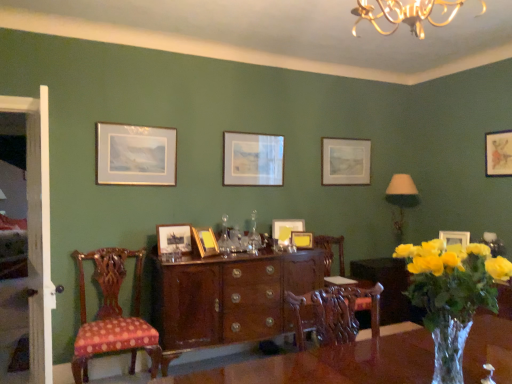
In order to face yellow matte picture frame at center, the fourth picture frame when ordered from right to left, should I rotate leftwards or rightwards?

A 6.381 degree turn to the right will do.

Describe the element at coordinates (302, 239) in the screenshot. Image resolution: width=512 pixels, height=384 pixels. I see `yellow matte picture frame at center, the fourth picture frame when ordered from right to left` at that location.

Image resolution: width=512 pixels, height=384 pixels. I want to click on white wooden door at left, so click(x=38, y=230).

Describe the element at coordinates (452, 295) in the screenshot. I see `translucent glass vase at lower right` at that location.

In order to face matte wooden picture frame at center, which is the 2th picture frame from left to right, should I rotate leftwards or rightwards?

You should look left and rotate roughly 10.808 degrees.

How much space does matte wooden picture frame at center, which is the 2th picture frame from left to right, occupy horizontally?

2.73 inches.

Find the location of a particular element. mahogany wood chair at center, acting as the second chair starting from the front is located at coordinates (331, 252).

What is the approximate width of polka dot fabric chair at left, placed as the 2th chair when sorted from right to left?

It is 22.03 inches.

You are a GUI agent. You are given a task and a screenshot of the screen. Output one action in this format:
    pyautogui.click(x=<x>, y=<y>)
    Task: Click on the yellow matte picture frame at center, the fourth picture frame when ordered from right to left
    
    Given the screenshot: What is the action you would take?
    pyautogui.click(x=302, y=239)

Can you tell me how much matte gold picture frame at upper right, which is the second picture frame in right-to-left order, and yellow matte picture frame at center, positioned as the sixth picture frame in left-to-right order, differ in facing direction?

19.4 degrees.

In the scene shown: Considering the relative sizes of matte gold picture frame at upper right, the 8th picture frame from the left, and yellow matte picture frame at center, the fourth picture frame when ordered from right to left, in the image provided, is matte gold picture frame at upper right, the 8th picture frame from the left, thinner than yellow matte picture frame at center, the fourth picture frame when ordered from right to left,?

Correct, the width of matte gold picture frame at upper right, the 8th picture frame from the left, is less than that of yellow matte picture frame at center, the fourth picture frame when ordered from right to left.

Could yellow matte picture frame at center, the fourth picture frame when ordered from right to left, be considered to be inside matte gold picture frame at upper right, the 8th picture frame from the left?

No, yellow matte picture frame at center, the fourth picture frame when ordered from right to left, is not a part of matte gold picture frame at upper right, the 8th picture frame from the left.

Is matte gold picture frame at upper right, which is the second picture frame in right-to-left order, oriented towards yellow matte picture frame at center, positioned as the sixth picture frame in left-to-right order?

No, matte gold picture frame at upper right, which is the second picture frame in right-to-left order, is not oriented towards yellow matte picture frame at center, positioned as the sixth picture frame in left-to-right order.

Is matte gold picture frame at upper right, which is the second picture frame in right-to-left order, positioned beyond the bounds of matte wooden picture frame at center, marked as the eighth picture frame in a right-to-left arrangement?

Yes, matte gold picture frame at upper right, which is the second picture frame in right-to-left order, is outside of matte wooden picture frame at center, marked as the eighth picture frame in a right-to-left arrangement.

Which of these two, matte gold picture frame at upper right, the 8th picture frame from the left, or matte wooden picture frame at center, which is the 2th picture frame from left to right, stands shorter?

matte gold picture frame at upper right, the 8th picture frame from the left, is shorter.

From a real-world perspective, is matte gold picture frame at upper right, which is the second picture frame in right-to-left order, below matte wooden picture frame at center, marked as the eighth picture frame in a right-to-left arrangement?

Yes.

Consider the image. Which is more to the right, matte gold picture frame at upper right, which is the second picture frame in right-to-left order, or matte wooden picture frame at center, marked as the eighth picture frame in a right-to-left arrangement?

matte gold picture frame at upper right, which is the second picture frame in right-to-left order, is more to the right.

From a real-world perspective, does white fabric lampshade at upper right stand above matte gold picture frame at center, which appears as the 4th picture frame when viewed from the left?

No, from a real-world perspective, white fabric lampshade at upper right is not on top of matte gold picture frame at center, which appears as the 4th picture frame when viewed from the left.

Is white fabric lampshade at upper right located outside matte gold picture frame at center, acting as the 6th picture frame starting from the right?

That's correct, white fabric lampshade at upper right is outside of matte gold picture frame at center, acting as the 6th picture frame starting from the right.

Is white fabric lampshade at upper right facing towards matte gold picture frame at center, acting as the 6th picture frame starting from the right?

No, white fabric lampshade at upper right is not turned towards matte gold picture frame at center, acting as the 6th picture frame starting from the right.

Considering the sizes of white fabric lampshade at upper right and matte gold picture frame at center, acting as the 6th picture frame starting from the right, in the image, is white fabric lampshade at upper right taller or shorter than matte gold picture frame at center, acting as the 6th picture frame starting from the right,?

In the image, white fabric lampshade at upper right appears to be taller than matte gold picture frame at center, acting as the 6th picture frame starting from the right.

From the image's perspective, is yellow matte picture frame at center, the fifth picture frame viewed from the right, located beneath gold-framed print at upper left, which ranks as the 1th picture frame in left-to-right order?

Yes, from the image's perspective, yellow matte picture frame at center, the fifth picture frame viewed from the right, is below gold-framed print at upper left, which ranks as the 1th picture frame in left-to-right order.

From the image's perspective, starting from the yellow matte picture frame at center, the fifth picture frame viewed from the right, which picture frame is the 1st one above? Please provide its 2D coordinates.

[(135, 155)]

Considering the relative sizes of yellow matte picture frame at center, the fifth picture frame viewed from the right, and gold-framed print at upper left, which ranks as the 9th picture frame in right-to-left order, in the image provided, is yellow matte picture frame at center, the fifth picture frame viewed from the right, bigger than gold-framed print at upper left, which ranks as the 9th picture frame in right-to-left order,?

Incorrect, yellow matte picture frame at center, the fifth picture frame viewed from the right, is not larger than gold-framed print at upper left, which ranks as the 9th picture frame in right-to-left order.

Is gold-framed print at upper left, which ranks as the 1th picture frame in left-to-right order, a part of yellow matte picture frame at center, acting as the 5th picture frame starting from the left?

No, gold-framed print at upper left, which ranks as the 1th picture frame in left-to-right order, is located outside of yellow matte picture frame at center, acting as the 5th picture frame starting from the left.

In terms of width, does matte gold picture frame at center, which appears as the 4th picture frame when viewed from the left, look wider or thinner when compared to yellow matte picture frame at center, the fourth picture frame when ordered from right to left?

In the image, matte gold picture frame at center, which appears as the 4th picture frame when viewed from the left, appears to be more narrow than yellow matte picture frame at center, the fourth picture frame when ordered from right to left.

From a real-world perspective, is matte gold picture frame at center, which appears as the 4th picture frame when viewed from the left, located beneath yellow matte picture frame at center, positioned as the sixth picture frame in left-to-right order?

Actually, matte gold picture frame at center, which appears as the 4th picture frame when viewed from the left, is physically above yellow matte picture frame at center, positioned as the sixth picture frame in left-to-right order, in the real world.

How distant is matte gold picture frame at center, which appears as the 4th picture frame when viewed from the left, from yellow matte picture frame at center, the fourth picture frame when ordered from right to left?

A distance of 29.03 inches exists between matte gold picture frame at center, which appears as the 4th picture frame when viewed from the left, and yellow matte picture frame at center, the fourth picture frame when ordered from right to left.

Is point (230, 160) in front of point (295, 234)?

No.

Does glossy wood cabinet at center appear on the right side of matte wooden picture frame at center, marked as the eighth picture frame in a right-to-left arrangement?

Yes, glossy wood cabinet at center is to the right of matte wooden picture frame at center, marked as the eighth picture frame in a right-to-left arrangement.

Can we say glossy wood cabinet at center lies outside matte wooden picture frame at center, which is the 2th picture frame from left to right?

Absolutely, glossy wood cabinet at center is external to matte wooden picture frame at center, which is the 2th picture frame from left to right.

From a real-world perspective, is glossy wood cabinet at center beneath matte wooden picture frame at center, which is the 2th picture frame from left to right?

Indeed, from a real-world perspective, glossy wood cabinet at center is positioned beneath matte wooden picture frame at center, which is the 2th picture frame from left to right.

From their relative heights in the image, would you say glossy wood cabinet at center is taller or shorter than matte wooden picture frame at center, which is the 2th picture frame from left to right?

glossy wood cabinet at center is taller than matte wooden picture frame at center, which is the 2th picture frame from left to right.

From a real-world perspective, is gold-framed print at upper left, which ranks as the 1th picture frame in left-to-right order, on white wooden door at left?

Yes, from a real-world perspective, gold-framed print at upper left, which ranks as the 1th picture frame in left-to-right order, is on top of white wooden door at left.

Measure the distance between gold-framed print at upper left, which ranks as the 1th picture frame in left-to-right order, and white wooden door at left.

They are 38.42 inches apart.

Which point is more forward, (110, 140) or (35, 188)?

Point (35, 188)

Considering the sizes of objects gold-framed print at upper left, which ranks as the 9th picture frame in right-to-left order, and white wooden door at left in the image provided, who is smaller, gold-framed print at upper left, which ranks as the 9th picture frame in right-to-left order, or white wooden door at left?

Smaller between the two is gold-framed print at upper left, which ranks as the 9th picture frame in right-to-left order.

In order to click on the 2nd picture frame to the right of the yellow matte picture frame at center, the fourth picture frame when ordered from right to left, starting your count from the anchor in this screenshot , I will do pyautogui.click(x=455, y=237).

I want to click on the 6th picture frame in front of the matte gold picture frame at upper right, which is the second picture frame in right-to-left order, so click(174, 238).

When comparing their distances from translucent glass vase at lower right, does matte gold picture frame at center, which appears as the 4th picture frame when viewed from the left, or glossy wood cabinet at center seem closer?

glossy wood cabinet at center is positioned closer to the anchor translucent glass vase at lower right.

Looking at the image, which one is located closer to matte gold picture frame at upper right, the 8th picture frame from the left, matte silver picture frame at center, the 3th picture frame when ordered from right to left, or gold-framed print at upper left, which ranks as the 1th picture frame in left-to-right order?

The object closer to matte gold picture frame at upper right, the 8th picture frame from the left, is matte silver picture frame at center, the 3th picture frame when ordered from right to left.

Which object lies further to the anchor point translucent glass vase at lower right, white fabric lampshade at upper right or polka dot fabric chair at left, placed as the 2th chair when sorted from right to left?

Based on the image, white fabric lampshade at upper right appears to be further to translucent glass vase at lower right.

From the image, which object appears to be farther from matte gold picture frame at upper right, the first picture frame viewed from the right, wooden picture frame at center, placed as the third picture frame when sorted from left to right, or matte wooden picture frame at center, which is the 2th picture frame from left to right?

matte wooden picture frame at center, which is the 2th picture frame from left to right, is positioned further to the anchor matte gold picture frame at upper right, the first picture frame viewed from the right.

Looking at the image, which one is located further to matte silver picture frame at center, marked as the seventh picture frame in a left-to-right arrangement, white fabric lampshade at upper right or wooden picture frame at center, placed as the third picture frame when sorted from left to right?

The object further to matte silver picture frame at center, marked as the seventh picture frame in a left-to-right arrangement, is wooden picture frame at center, placed as the third picture frame when sorted from left to right.

Looking at this image, based on their spatial positions, is white wooden door at left or matte silver picture frame at center, the 3th picture frame when ordered from right to left, closer to matte gold picture frame at center, which appears as the 4th picture frame when viewed from the left?

matte silver picture frame at center, the 3th picture frame when ordered from right to left, is positioned closer to the anchor matte gold picture frame at center, which appears as the 4th picture frame when viewed from the left.

Estimate the real-world distances between objects in this image. Which object is closer to yellow matte picture frame at center, the fifth picture frame viewed from the right, white fabric lampshade at upper right or matte wooden picture frame at center, marked as the eighth picture frame in a right-to-left arrangement?

Among the two, matte wooden picture frame at center, marked as the eighth picture frame in a right-to-left arrangement, is located nearer to yellow matte picture frame at center, the fifth picture frame viewed from the right.

Which object lies further to the anchor point translucent glass vase at lower right, matte wooden picture frame at center, which is the 2th picture frame from left to right, or matte gold picture frame at upper right, which is the second picture frame in right-to-left order?

matte gold picture frame at upper right, which is the second picture frame in right-to-left order, lies further to translucent glass vase at lower right than the other object.

You are a GUI agent. You are given a task and a screenshot of the screen. Output one action in this format:
    pyautogui.click(x=<x>, y=<y>)
    Task: Click on the cabinetry between translucent glass vase at lower right and yellow matte picture frame at center, acting as the 5th picture frame starting from the left, in the front-back direction
    
    Given the screenshot: What is the action you would take?
    pyautogui.click(x=228, y=298)

Identify the location of cabinetry between translucent glass vase at lower right and matte silver picture frame at center, the 3th picture frame when ordered from right to left, in the front-back direction. (228, 298).

Identify the location of cabinetry between matte wooden picture frame at center, which is the 2th picture frame from left to right, and yellow matte picture frame at center, the fifth picture frame viewed from the right, from left to right. This screenshot has height=384, width=512. (228, 298).

Where is `lamp situated between glossy wood cabinet at center and matte gold picture frame at upper right, which is the second picture frame in right-to-left order, from left to right`? This screenshot has width=512, height=384. lamp situated between glossy wood cabinet at center and matte gold picture frame at upper right, which is the second picture frame in right-to-left order, from left to right is located at coordinates (401, 200).